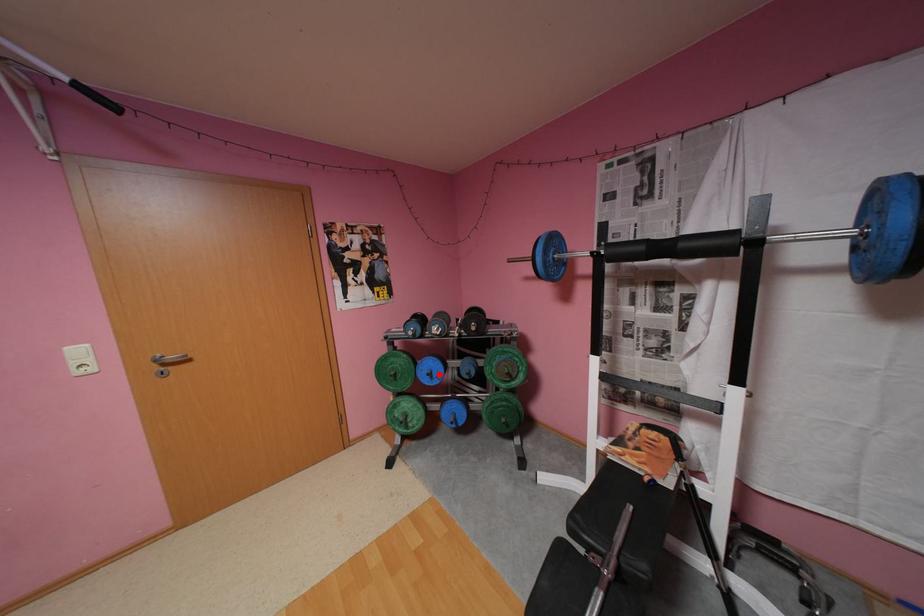
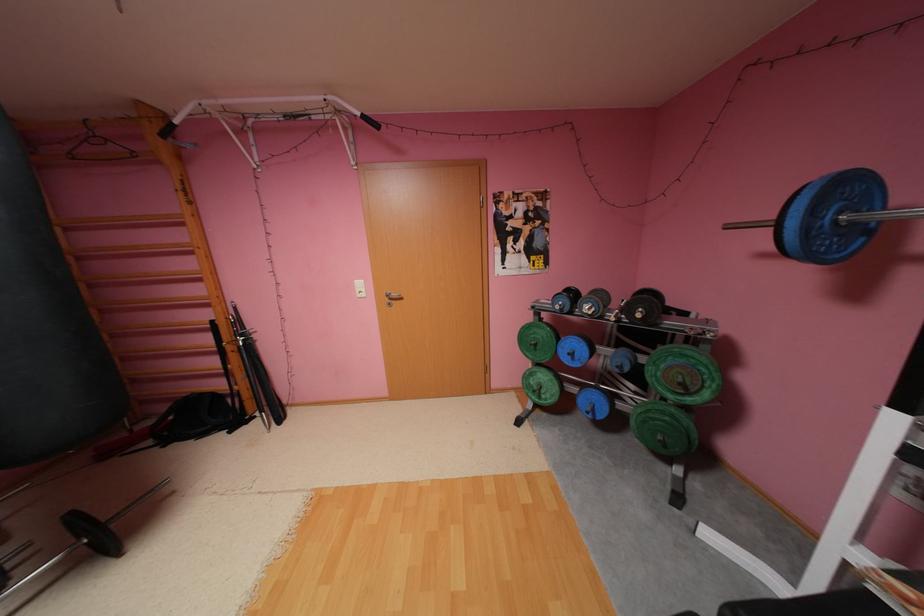
Where in the second image is the point corresponding to the highlighted location from the first image?

(580, 354)